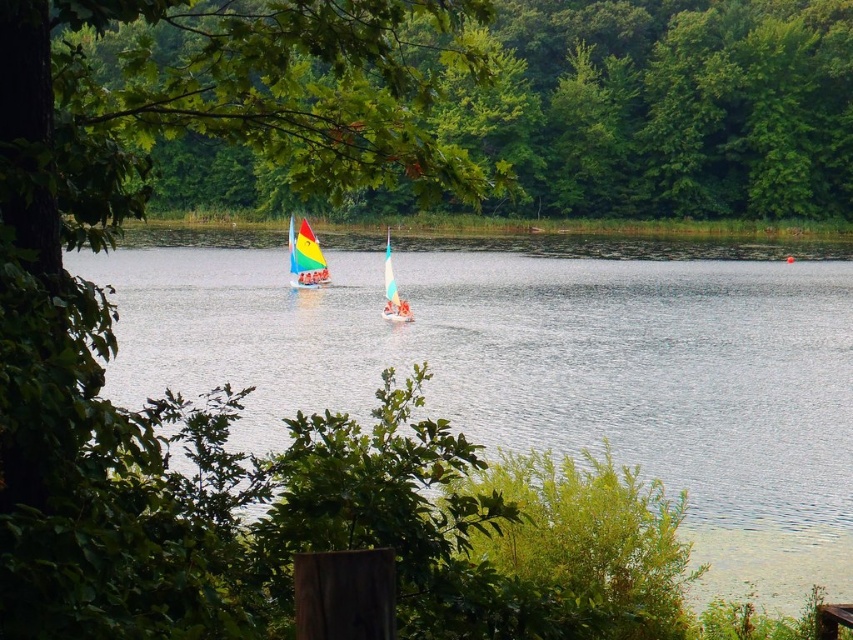
Question: Which object is positioned closest to the clear water at center?

Choices:
 (A) green leafy tree at upper center
 (B) rainbow sailboat at center

Answer: (A)

Question: Which of the following is the farthest from the observer?

Choices:
 (A) (386, 282)
 (B) (288, 240)
 (C) (717, 160)

Answer: (C)

Question: Among these objects, which one is farthest from the camera?

Choices:
 (A) clear water at center
 (B) rainbow sailboat at center

Answer: (B)

Question: Is green leafy tree at upper center smaller than white plastic sailboat at center?

Choices:
 (A) no
 (B) yes

Answer: (A)

Question: Is green leafy tree at upper center positioned in front of rainbow sailboat at center?

Choices:
 (A) no
 (B) yes

Answer: (B)

Question: Can you confirm if green leafy tree at upper center is smaller than white plastic sailboat at center?

Choices:
 (A) yes
 (B) no

Answer: (B)